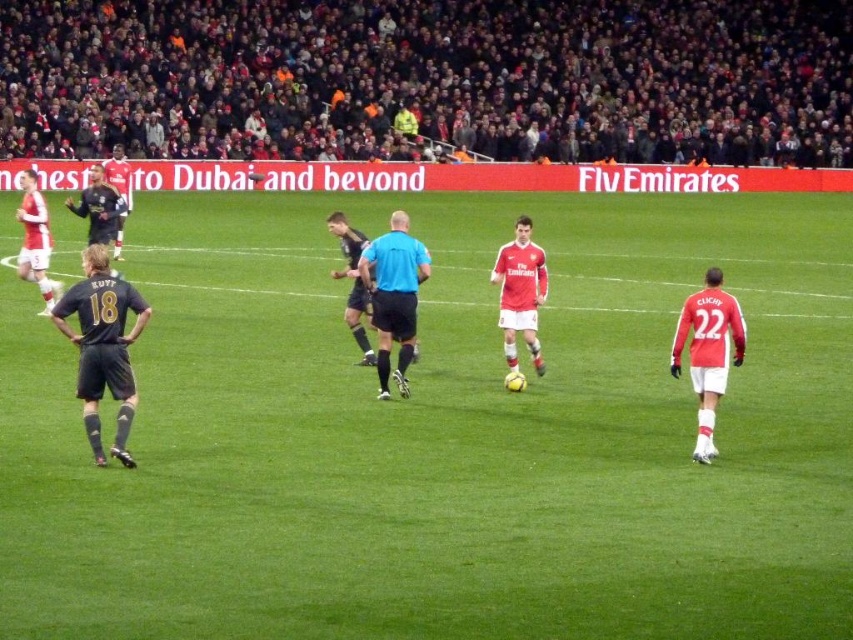
Is matte black jersey at left positioned at the back of black jersey at left?

No.

Locate an element on the screen. This screenshot has height=640, width=853. matte black jersey at left is located at coordinates (35, 241).

Who is more distant from viewer, [102,289] or [82,211]?

Positioned behind is point [82,211].

Which is more to the left, dark blue jersey at left or black jersey at left?

From the viewer's perspective, black jersey at left appears more on the left side.

What do you see at coordinates (103, 346) in the screenshot? The image size is (853, 640). I see `dark blue jersey at left` at bounding box center [103, 346].

At what (x,y) coordinates should I click in order to perform the action: click on dark blue jersey at left. Please return your answer as a coordinate pair (x, y). The image size is (853, 640). Looking at the image, I should click on (103, 346).

Does green grass soccer field at center appear on the left side of blue fabric referee at center?

Incorrect, green grass soccer field at center is not on the left side of blue fabric referee at center.

Does green grass soccer field at center have a smaller size compared to blue fabric referee at center?

No.

Is point (566, 499) farther from viewer compared to point (415, 291)?

No, (566, 499) is in front of (415, 291).

At what (x,y) coordinates should I click in order to perform the action: click on green grass soccer field at center. Please return your answer as a coordinate pair (x, y). Looking at the image, I should click on 442,433.